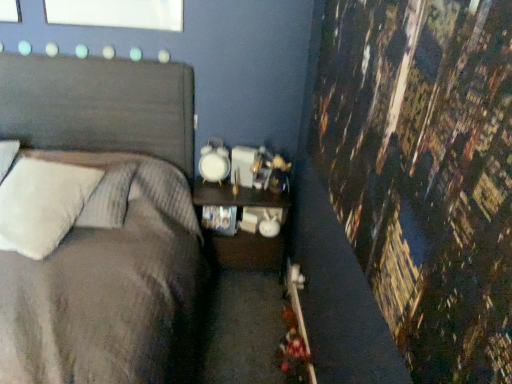
Question: Is textured gray bed at left thinner than wooden nightstand at center?

Choices:
 (A) yes
 (B) no

Answer: (B)

Question: Is wooden nightstand at center at the back of textured gray bed at left?

Choices:
 (A) yes
 (B) no

Answer: (B)

Question: Is textured gray bed at left at the right side of wooden nightstand at center?

Choices:
 (A) no
 (B) yes

Answer: (A)

Question: Is textured gray bed at left oriented towards wooden nightstand at center?

Choices:
 (A) no
 (B) yes

Answer: (A)

Question: From the image's perspective, does textured gray bed at left appear lower than wooden nightstand at center?

Choices:
 (A) no
 (B) yes

Answer: (B)

Question: Is point (28, 210) closer or farther from the camera than point (58, 69)?

Choices:
 (A) closer
 (B) farther

Answer: (A)

Question: From a real-world perspective, is white fluffy pillow at left above or below textured gray bed at left?

Choices:
 (A) below
 (B) above

Answer: (B)

Question: Do you think white fluffy pillow at left is within textured gray bed at left, or outside of it?

Choices:
 (A) outside
 (B) inside

Answer: (B)

Question: Considering the positions of white fluffy pillow at left and textured gray bed at left in the image, is white fluffy pillow at left taller or shorter than textured gray bed at left?

Choices:
 (A) tall
 (B) short

Answer: (B)

Question: Based on their sizes in the image, would you say textured gray bed at left is bigger or smaller than wooden nightstand at center?

Choices:
 (A) small
 (B) big

Answer: (B)

Question: Is textured gray bed at left wider or thinner than wooden nightstand at center?

Choices:
 (A) thin
 (B) wide

Answer: (B)

Question: Is point (41, 347) closer or farther from the camera than point (221, 192)?

Choices:
 (A) farther
 (B) closer

Answer: (B)

Question: From the image's perspective, relative to wooden nightstand at center, is textured gray bed at left above or below?

Choices:
 (A) below
 (B) above

Answer: (A)

Question: Considering the positions of wooden nightstand at center and textured gray bed at left in the image, is wooden nightstand at center bigger or smaller than textured gray bed at left?

Choices:
 (A) big
 (B) small

Answer: (B)

Question: From their relative heights in the image, would you say wooden nightstand at center is taller or shorter than textured gray bed at left?

Choices:
 (A) short
 (B) tall

Answer: (A)